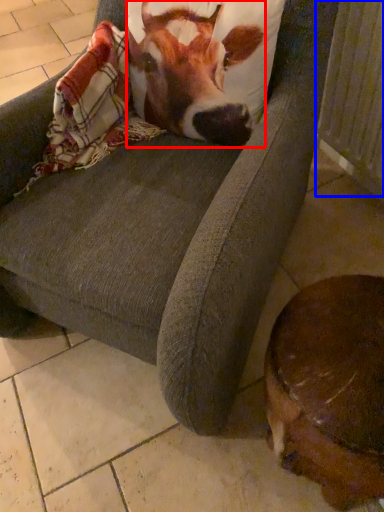
Question: Which object appears farthest to the camera in this image, cattle (highlighted by a red box) or radiator (highlighted by a blue box)?

Choices:
 (A) cattle
 (B) radiator

Answer: (B)